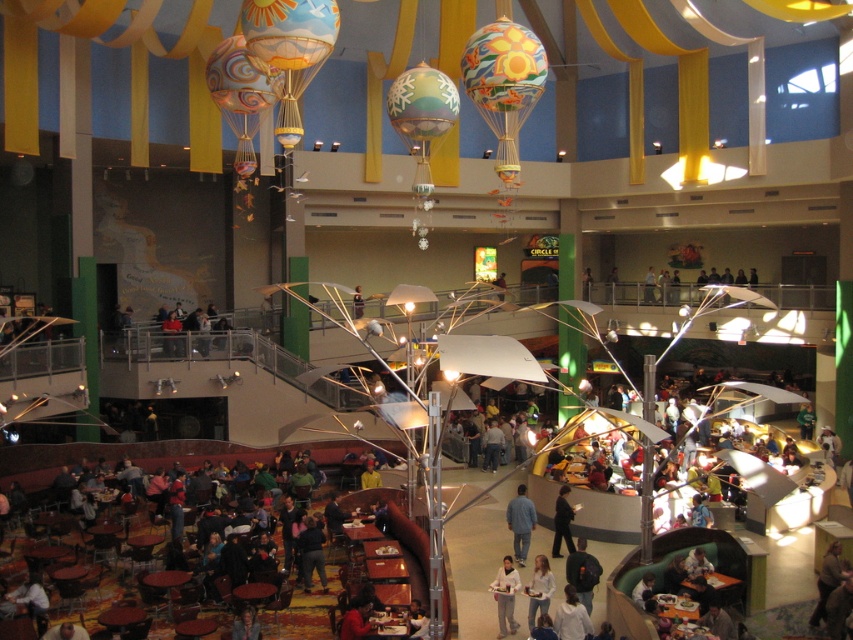
You are standing in the food court and see a person wearing denim pants at center and a person wearing white fabric shirt at lower right. Which clothing item is positioned more to the left?

The denim pants at center is positioned more to the left than the white fabric shirt at lower right.

You are a photographer standing in the food court and want to take a photo of the dark blue shirt at center and denim pants at center. However, you notice that one of the objects is blocking the other. Which object is being blocked and by which object?

The dark blue shirt at center is behind the denim pants at center, so the dark blue shirt at center is being blocked by the denim pants at center.

Consider the image. You are standing in the food court and need to reach the exit located near the white fabric shirt at lower right. The denim pants at center is blocking your path. Can you walk around them without getting too close? Explain your reasoning.

The denim pants at center and white fabric shirt at lower right are 10.62 meters apart. Since the distance between them is quite large, you can easily walk around the denim pants at center while maintaining a comfortable distance from them to reach the exit near the white fabric shirt at lower right.